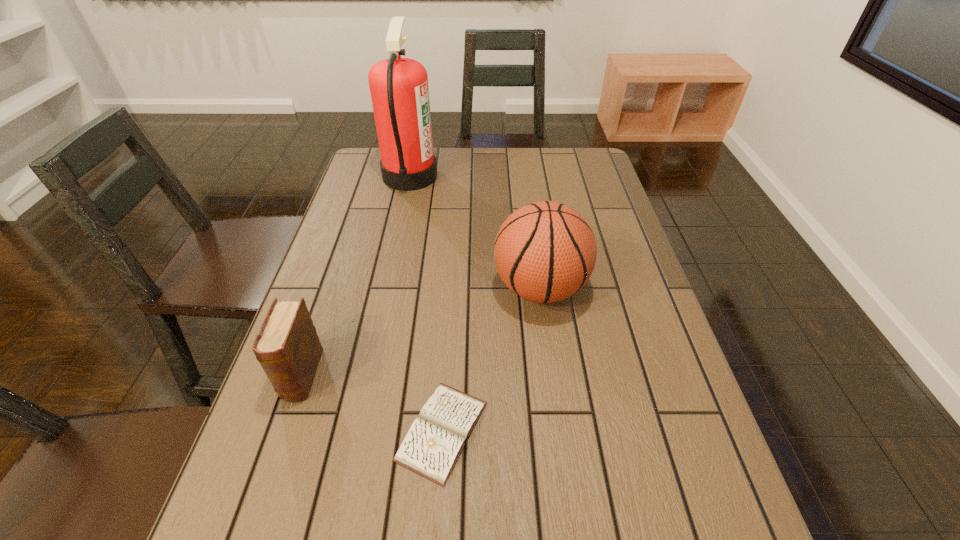
Locate an element on the screen. The height and width of the screenshot is (540, 960). the farthest object is located at coordinates (399, 90).

In order to click on fire extinguisher in this screenshot , I will do `click(399, 90)`.

Where is `the second tallest object`? This screenshot has width=960, height=540. the second tallest object is located at coordinates (545, 251).

Image resolution: width=960 pixels, height=540 pixels. I want to click on the rightmost object, so click(x=545, y=251).

Where is `the third tallest object`? The width and height of the screenshot is (960, 540). the third tallest object is located at coordinates click(287, 346).

This screenshot has height=540, width=960. What are the coordinates of `the left diary` in the screenshot? It's located at (287, 346).

Find the location of `the right diary`. the right diary is located at coordinates (437, 436).

This screenshot has height=540, width=960. I want to click on the shorter diary, so click(x=437, y=436).

Locate an element on the screen. The width and height of the screenshot is (960, 540). vacant point located at the nozzle of the fire extinguisher is located at coordinates (520, 176).

You are a GUI agent. You are given a task and a screenshot of the screen. Output one action in this format:
    pyautogui.click(x=<x>, y=<y>)
    Task: Click on the vacant space located 0.270m on the side where the inflation valve is located
    
    Given the screenshot: What is the action you would take?
    pyautogui.click(x=385, y=288)